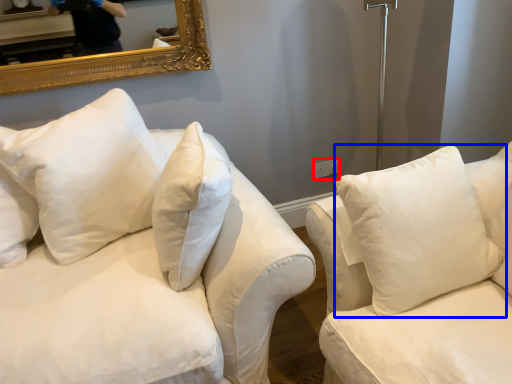
Question: Which of the following is the farthest to the observer, electric outlet (highlighted by a red box) or pillow (highlighted by a blue box)?

Choices:
 (A) electric outlet
 (B) pillow

Answer: (A)